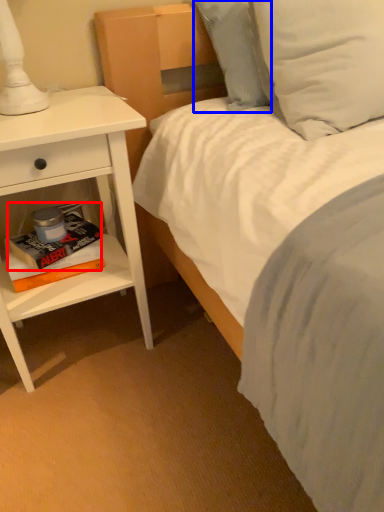
Question: Which object appears closest to the camera in this image, paperback book (highlighted by a red box) or pillow (highlighted by a blue box)?

Choices:
 (A) paperback book
 (B) pillow

Answer: (B)